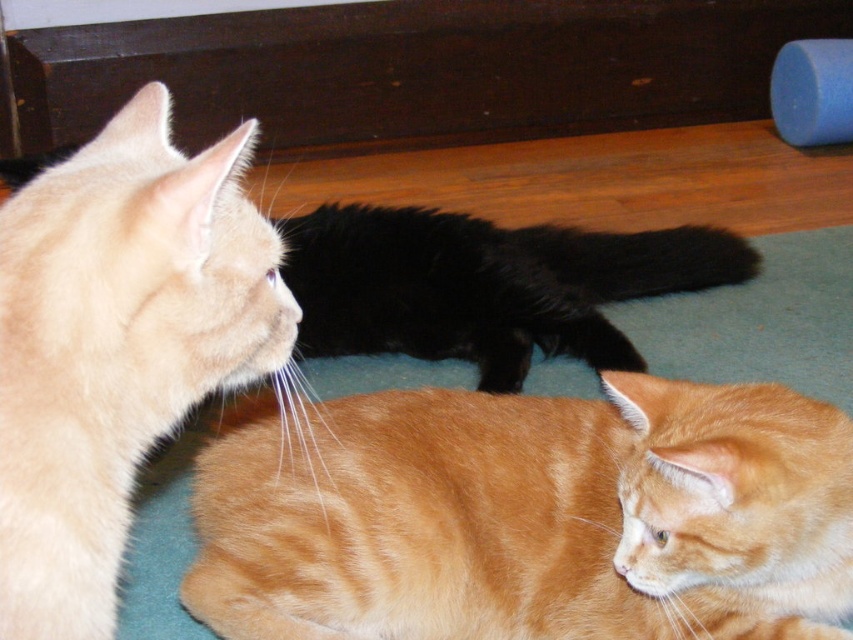
Question: Does orange fur cat at lower center have a lesser width compared to black fluffy cat at center?

Choices:
 (A) no
 (B) yes

Answer: (B)

Question: Can you confirm if orange fur cat at lower center is wider than light orange fur cat at upper left?

Choices:
 (A) yes
 (B) no

Answer: (A)

Question: Which of the following is the closest to the observer?

Choices:
 (A) (495, 364)
 (B) (65, 499)

Answer: (B)

Question: Is orange fur cat at lower center bigger than black fluffy cat at center?

Choices:
 (A) yes
 (B) no

Answer: (B)

Question: Which point appears closest to the camera in this image?

Choices:
 (A) (492, 540)
 (B) (102, 548)
 (C) (519, 388)

Answer: (B)

Question: Which object is the farthest from the black fluffy cat at center?

Choices:
 (A) orange fur cat at lower center
 (B) light orange fur cat at upper left

Answer: (B)